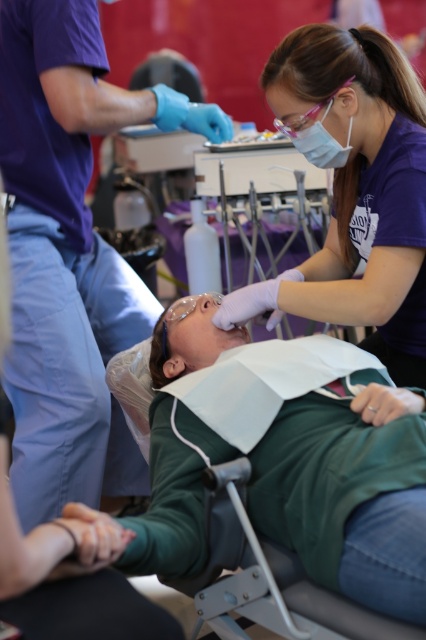
Between green fabric at center and purple smooth shirt at upper center, which one has less height?

With less height is green fabric at center.

The width and height of the screenshot is (426, 640). In order to click on green fabric at center in this screenshot , I will do `click(287, 456)`.

I want to click on green fabric at center, so click(287, 456).

Can you confirm if matte purple shirt at upper right is taller than purple smooth shirt at upper center?

Correct, matte purple shirt at upper right is much taller as purple smooth shirt at upper center.

Where is `matte purple shirt at upper right`? matte purple shirt at upper right is located at coordinates (69, 253).

Is point (340, 563) closer to camera compared to point (112, 125)?

Yes, point (340, 563) is in front of point (112, 125).

Which is more to the right, green fabric at center or matte purple shirt at upper right?

Positioned to the right is green fabric at center.

Locate an element on the screen. green fabric at center is located at coordinates (287, 456).

Where is `green fabric at center`? This screenshot has width=426, height=640. green fabric at center is located at coordinates (x=287, y=456).